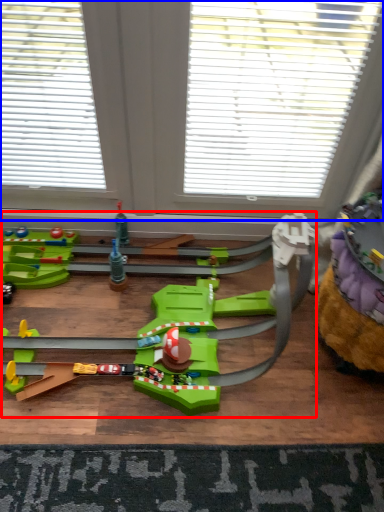
Question: Among these objects, which one is nearest to the camera, toy (highlighted by a red box) or window (highlighted by a blue box)?

Choices:
 (A) toy
 (B) window

Answer: (A)